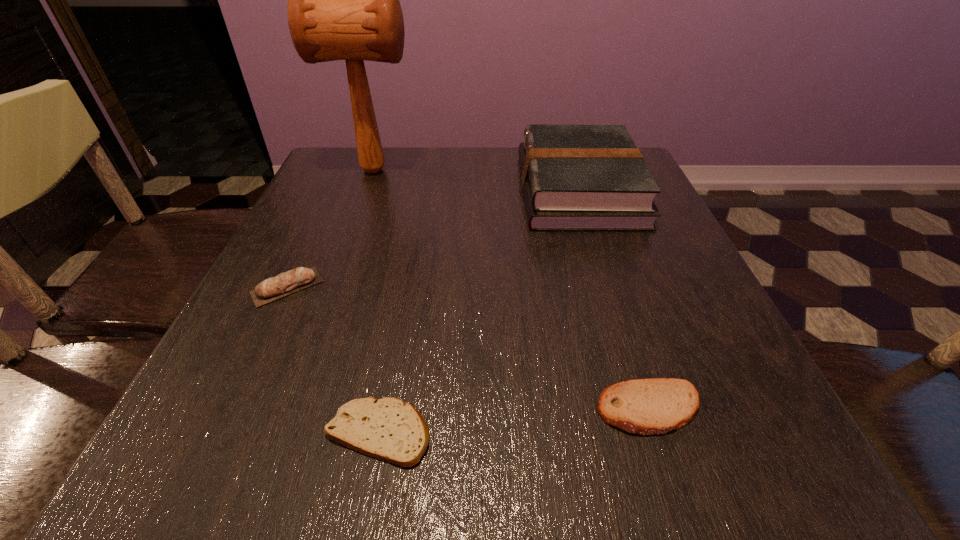
Identify the location of vacant point located between the rightmost pita bread and the second tallest object. This screenshot has width=960, height=540. (614, 299).

Where is `free space between the hardback book and the mallet`? The height and width of the screenshot is (540, 960). free space between the hardback book and the mallet is located at coordinates (476, 180).

Identify the location of free area in between the tallest object and the third nearest object. The width and height of the screenshot is (960, 540). (330, 228).

The height and width of the screenshot is (540, 960). What are the coordinates of `vacant area that lies between the hardback book and the third nearest object` in the screenshot? It's located at (433, 238).

This screenshot has width=960, height=540. Find the location of `free spot between the fourth tallest object and the mallet`. free spot between the fourth tallest object and the mallet is located at coordinates (512, 289).

Locate an element on the screen. This screenshot has height=540, width=960. free area in between the farthest pita bread and the second tallest object is located at coordinates (433, 238).

Where is `vacant point located between the hardback book and the second shortest pita bread`? The image size is (960, 540). vacant point located between the hardback book and the second shortest pita bread is located at coordinates (614, 299).

Find the location of a particular element. This screenshot has width=960, height=540. free space that is in between the fourth shortest object and the rightmost pita bread is located at coordinates (614, 299).

Locate an element on the screen. This screenshot has width=960, height=540. free space between the leftmost pita bread and the second shortest pita bread is located at coordinates (468, 348).

I want to click on object identified as the fourth closest to the mallet, so click(x=653, y=406).